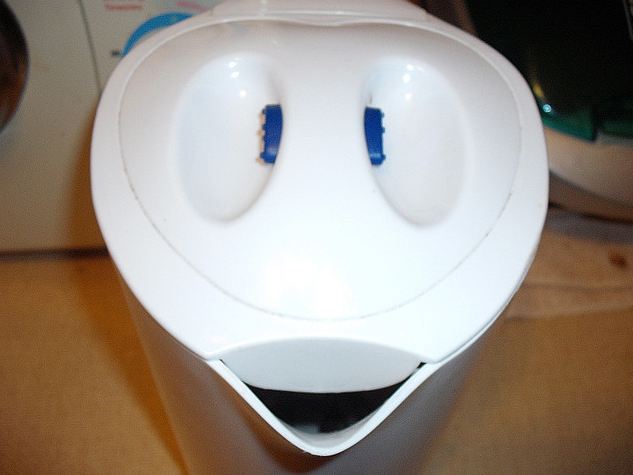
Identify the location of white pitcher top. (453, 318).